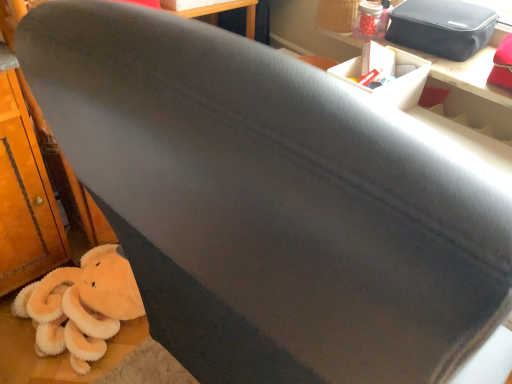
Question: From a real-world perspective, is matte black table at upper right over white cardboard box at upper right?

Choices:
 (A) yes
 (B) no

Answer: (B)

Question: Does matte black table at upper right turn towards white cardboard box at upper right?

Choices:
 (A) no
 (B) yes

Answer: (B)

Question: Is matte black table at upper right bigger than white cardboard box at upper right?

Choices:
 (A) no
 (B) yes

Answer: (B)

Question: From the image's perspective, would you say matte black table at upper right is positioned over white cardboard box at upper right?

Choices:
 (A) yes
 (B) no

Answer: (A)

Question: Is matte black table at upper right shorter than white cardboard box at upper right?

Choices:
 (A) yes
 (B) no

Answer: (A)

Question: Is matte black table at upper right positioned in front of white cardboard box at upper right?

Choices:
 (A) no
 (B) yes

Answer: (B)

Question: Is the depth of white cardboard box at upper right greater than that of black fabric bag at upper right?

Choices:
 (A) no
 (B) yes

Answer: (A)

Question: Does white cardboard box at upper right have a greater height compared to black fabric bag at upper right?

Choices:
 (A) yes
 (B) no

Answer: (A)

Question: Is black fabric bag at upper right completely or partially inside white cardboard box at upper right?

Choices:
 (A) yes
 (B) no

Answer: (B)

Question: Considering the relative sizes of white cardboard box at upper right and black fabric bag at upper right in the image provided, is white cardboard box at upper right smaller than black fabric bag at upper right?

Choices:
 (A) yes
 (B) no

Answer: (A)

Question: Is white cardboard box at upper right outside of black fabric bag at upper right?

Choices:
 (A) yes
 (B) no

Answer: (A)

Question: Is white cardboard box at upper right positioned in front of black fabric bag at upper right?

Choices:
 (A) yes
 (B) no

Answer: (A)

Question: Considering the relative sizes of matte black table at upper right and fluffy orange stuffed animal at lower left in the image provided, is matte black table at upper right wider than fluffy orange stuffed animal at lower left?

Choices:
 (A) no
 (B) yes

Answer: (A)